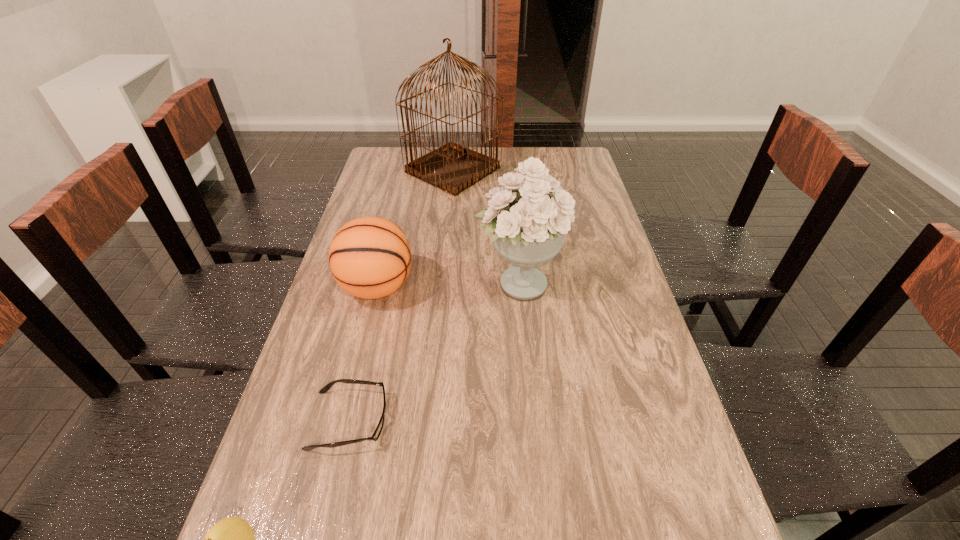
At what (x,y) coordinates should I click in order to perform the action: click on the farthest object. Please return your answer as a coordinate pair (x, y). Image resolution: width=960 pixels, height=540 pixels. Looking at the image, I should click on (453, 168).

Identify the location of the tallest object. This screenshot has width=960, height=540. pyautogui.click(x=453, y=168).

Locate an element on the screen. the fourth shortest object is located at coordinates (528, 217).

Find the location of a particular element. This screenshot has height=540, width=960. basketball is located at coordinates (370, 257).

Find the location of `the shortest object`. the shortest object is located at coordinates (377, 432).

Locate an element on the screen. the fourth farthest object is located at coordinates (377, 432).

Image resolution: width=960 pixels, height=540 pixels. I want to click on free spot located 0.340m on the front of the birdcage, so click(x=445, y=258).

Locate an element on the screen. The height and width of the screenshot is (540, 960). vacant region located on the front of the bouquet is located at coordinates (525, 351).

At what (x,y) coordinates should I click in order to perform the action: click on vacant space situated 0.300m on the right of the third tallest object. Please return your answer as a coordinate pair (x, y). The image size is (960, 540). Looking at the image, I should click on (521, 287).

Identify the location of vacant space located on the front-facing side of the spectacles. (560, 421).